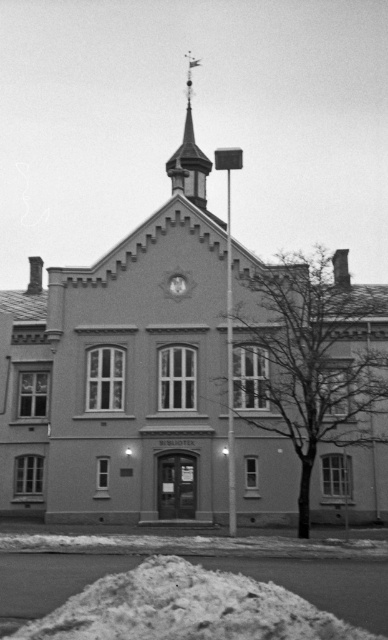
Question: Estimate the real-world distances between objects in this image. Which object is closer to the metallic clock at center?

Choices:
 (A) polished brass spire at upper center
 (B) white powdery snow at lower center

Answer: (A)

Question: Is white powdery snow at lower center above polished brass spire at upper center?

Choices:
 (A) no
 (B) yes

Answer: (A)

Question: Which of the following is the closest to the observer?

Choices:
 (A) [176, 285]
 (B) [15, 595]
 (C) [194, 189]

Answer: (B)

Question: Does polished brass spire at upper center have a greater width compared to metallic clock at center?

Choices:
 (A) no
 (B) yes

Answer: (B)

Question: Which object is positioned closest to the metallic clock at center?

Choices:
 (A) white powdery snow at lower center
 (B) polished brass spire at upper center

Answer: (B)

Question: Does polished brass spire at upper center appear over metallic clock at center?

Choices:
 (A) no
 (B) yes

Answer: (B)